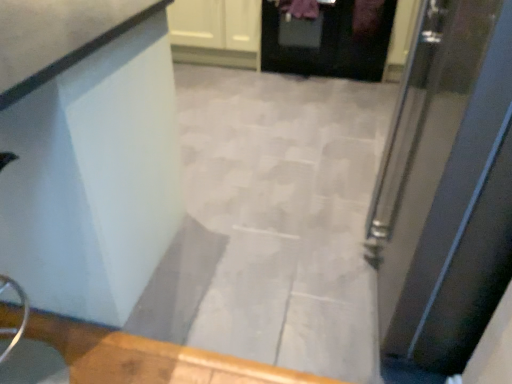
Question: Does white glossy counter at upper left come in front of metallic silver door at right, the second door when ordered from back to front?

Choices:
 (A) no
 (B) yes

Answer: (A)

Question: Does white glossy counter at upper left touch metallic silver door at right, which is the 1th door from front to back?

Choices:
 (A) no
 (B) yes

Answer: (A)

Question: Does white glossy counter at upper left come behind metallic silver door at right, which is the first door from bottom to top?

Choices:
 (A) no
 (B) yes

Answer: (B)

Question: Is white glossy counter at upper left not near metallic silver door at right, which is the first door from bottom to top?

Choices:
 (A) no
 (B) yes

Answer: (A)

Question: Considering the relative sizes of white glossy counter at upper left and metallic silver door at right, marked as the second door in a top-to-bottom arrangement, in the image provided, is white glossy counter at upper left bigger than metallic silver door at right, marked as the second door in a top-to-bottom arrangement,?

Choices:
 (A) yes
 (B) no

Answer: (A)

Question: Can you confirm if white glossy counter at upper left is smaller than metallic silver door at right, which is the 1th door from front to back?

Choices:
 (A) no
 (B) yes

Answer: (A)

Question: Is metallic silver door at right, marked as the second door in a top-to-bottom arrangement, not near black glossy door at upper center, which is counted as the 2th door, starting from the front?

Choices:
 (A) yes
 (B) no

Answer: (A)

Question: From the image's perspective, is metallic silver door at right, marked as the second door in a top-to-bottom arrangement, below black glossy door at upper center, which appears as the first door when viewed from the top?

Choices:
 (A) yes
 (B) no

Answer: (A)

Question: Are metallic silver door at right, the second door when ordered from back to front, and black glossy door at upper center, the 2th door from the bottom, beside each other?

Choices:
 (A) yes
 (B) no

Answer: (B)

Question: Is black glossy door at upper center, the 2th door from the bottom, located within metallic silver door at right, which is the first door from bottom to top?

Choices:
 (A) no
 (B) yes

Answer: (A)

Question: Is metallic silver door at right, which is the 1th door from front to back, facing away from black glossy door at upper center, acting as the first door starting from the back?

Choices:
 (A) yes
 (B) no

Answer: (B)

Question: Does metallic silver door at right, the second door when ordered from back to front, turn towards black glossy door at upper center, which appears as the first door when viewed from the top?

Choices:
 (A) yes
 (B) no

Answer: (B)

Question: Does metallic silver door at right, which is the 1th door from front to back, have a lesser width compared to white glossy cabinet at upper center?

Choices:
 (A) no
 (B) yes

Answer: (A)